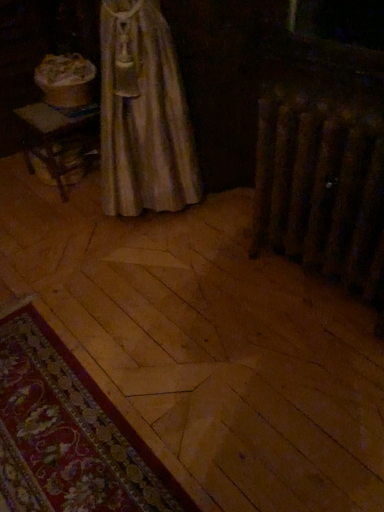
Question: Based on their positions, is floral carpet at lower left located to the left or right of rusty metal radiator at right?

Choices:
 (A) right
 (B) left

Answer: (B)

Question: Is floral carpet at lower left situated inside rusty metal radiator at right or outside?

Choices:
 (A) outside
 (B) inside

Answer: (A)

Question: From the image's perspective, is floral carpet at lower left positioned above or below rusty metal radiator at right?

Choices:
 (A) below
 (B) above

Answer: (A)

Question: Considering the positions of rusty metal radiator at right and floral carpet at lower left in the image, is rusty metal radiator at right bigger or smaller than floral carpet at lower left?

Choices:
 (A) small
 (B) big

Answer: (B)

Question: Would you say rusty metal radiator at right is to the left or to the right of floral carpet at lower left in the picture?

Choices:
 (A) right
 (B) left

Answer: (A)

Question: From the image's perspective, is rusty metal radiator at right located above or below floral carpet at lower left?

Choices:
 (A) above
 (B) below

Answer: (A)

Question: Looking at their shapes, would you say rusty metal radiator at right is wider or thinner than floral carpet at lower left?

Choices:
 (A) wide
 (B) thin

Answer: (B)